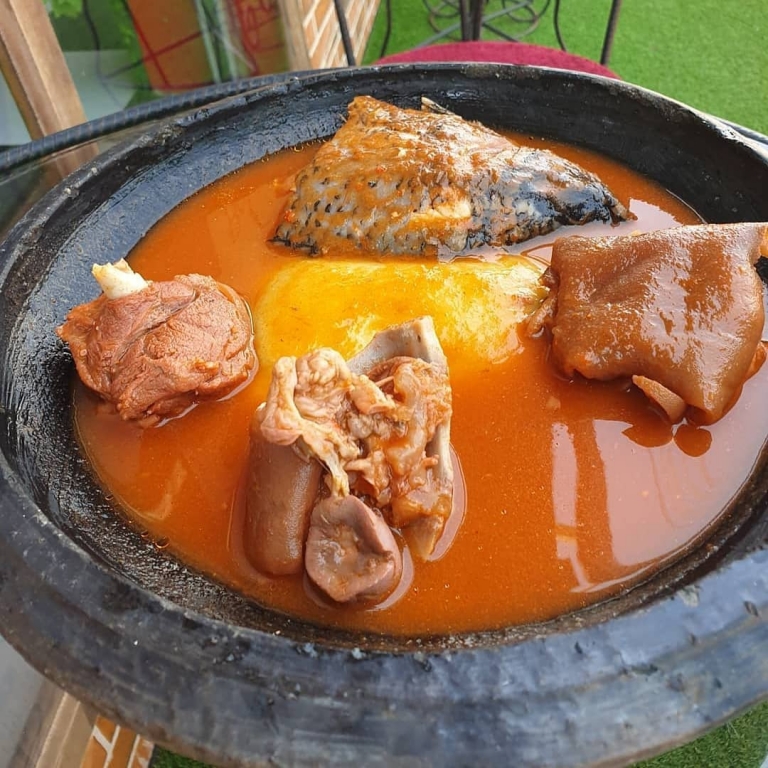
The width and height of the screenshot is (768, 768). I want to click on brick wall, so click(x=322, y=38).